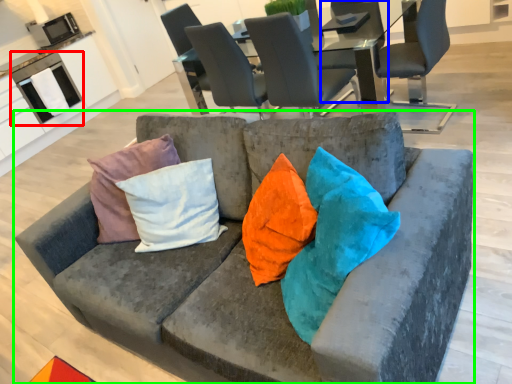
Question: Estimate the real-world distances between objects in this image. Which object is closer to appliance (highlighted by a red box), chair (highlighted by a blue box) or studio couch (highlighted by a green box)?

Choices:
 (A) chair
 (B) studio couch

Answer: (A)